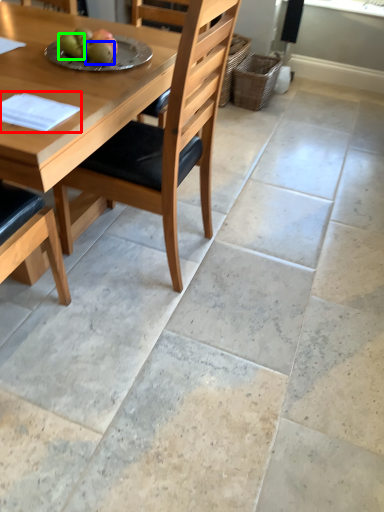
Question: Which object is the closest to the pad (highlighted by a red box)? Choose among these: fruit (highlighted by a blue box) or fruit (highlighted by a green box).

Choices:
 (A) fruit
 (B) fruit

Answer: (A)